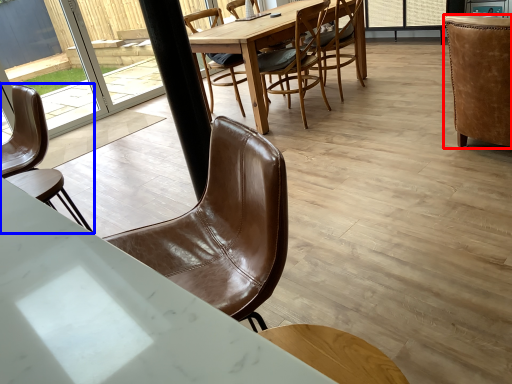
Question: Which of the following is the farthest to the observer, chair (highlighted by a red box) or chair (highlighted by a blue box)?

Choices:
 (A) chair
 (B) chair

Answer: (A)